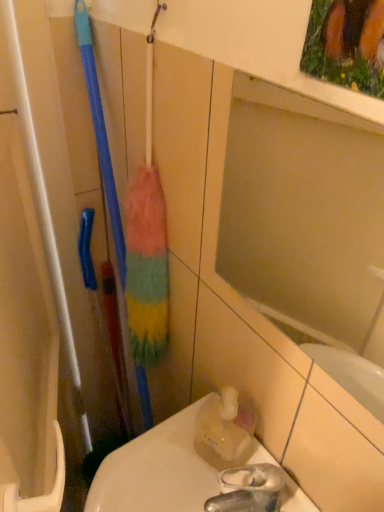
Question: Relative to matte glass mirror at upper center, is translucent plastic bottle at lower right in front or behind?

Choices:
 (A) behind
 (B) front

Answer: (A)

Question: From a real-world perspective, is translucent plastic bottle at lower right physically located above or below matte glass mirror at upper center?

Choices:
 (A) below
 (B) above

Answer: (A)

Question: Estimate the real-world distances between objects in this image. Which object is farther from the translucent plastic toilet at lower right?

Choices:
 (A) matte glass mirror at upper center
 (B) translucent plastic bottle at lower right

Answer: (A)

Question: Estimate the real-world distances between objects in this image. Which object is closer to the matte glass mirror at upper center?

Choices:
 (A) translucent plastic bottle at lower right
 (B) translucent plastic toilet at lower right

Answer: (A)